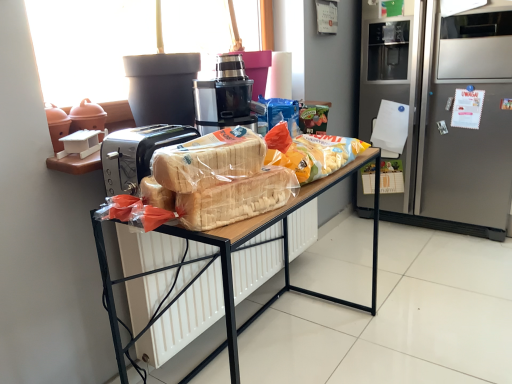
Question: From the image's perspective, is translucent plastic bread at center, arranged as the second snack when viewed from the back, on satin silver refrigerator at right?

Choices:
 (A) no
 (B) yes

Answer: (A)

Question: Does translucent plastic bread at center, arranged as the second snack when viewed from the back, lie in front of satin silver refrigerator at right?

Choices:
 (A) yes
 (B) no

Answer: (A)

Question: Is translucent plastic bread at center, which is the second snack from front to back, oriented away from satin silver refrigerator at right?

Choices:
 (A) no
 (B) yes

Answer: (A)

Question: Considering the relative sizes of translucent plastic bread at center, arranged as the second snack when viewed from the back, and satin silver refrigerator at right in the image provided, is translucent plastic bread at center, arranged as the second snack when viewed from the back, bigger than satin silver refrigerator at right?

Choices:
 (A) no
 (B) yes

Answer: (A)

Question: Is translucent plastic bread at center, which is the second snack from front to back, surrounding satin silver refrigerator at right?

Choices:
 (A) yes
 (B) no

Answer: (B)

Question: Considering the relative sizes of translucent plastic bread at center, arranged as the second snack when viewed from the back, and satin silver refrigerator at right in the image provided, is translucent plastic bread at center, arranged as the second snack when viewed from the back, taller than satin silver refrigerator at right?

Choices:
 (A) no
 (B) yes

Answer: (A)

Question: Considering the relative sizes of translucent plastic bread at center, the 1th snack viewed from the front, and black plastic juicer at center in the image provided, is translucent plastic bread at center, the 1th snack viewed from the front, thinner than black plastic juicer at center?

Choices:
 (A) yes
 (B) no

Answer: (A)

Question: Is translucent plastic bread at center, the 1th snack viewed from the front, in contact with black plastic juicer at center?

Choices:
 (A) no
 (B) yes

Answer: (A)

Question: Can you confirm if translucent plastic bread at center, positioned as the third snack in back-to-front order, is wider than black plastic juicer at center?

Choices:
 (A) no
 (B) yes

Answer: (A)

Question: Does translucent plastic bread at center, positioned as the third snack in back-to-front order, appear on the right side of black plastic juicer at center?

Choices:
 (A) no
 (B) yes

Answer: (B)

Question: From a real-world perspective, is translucent plastic bread at center, positioned as the third snack in back-to-front order, beneath black plastic juicer at center?

Choices:
 (A) yes
 (B) no

Answer: (A)

Question: Is translucent plastic bread at center, positioned as the third snack in back-to-front order, at the left side of black plastic juicer at center?

Choices:
 (A) no
 (B) yes

Answer: (A)

Question: Considering the relative positions of translucent plastic bag of chips at center, which is counted as the 1th snack, starting from the back, and translucent plastic bread at center, positioned as the third snack in back-to-front order, in the image provided, is translucent plastic bag of chips at center, which is counted as the 1th snack, starting from the back, to the left of translucent plastic bread at center, positioned as the third snack in back-to-front order, from the viewer's perspective?

Choices:
 (A) no
 (B) yes

Answer: (A)